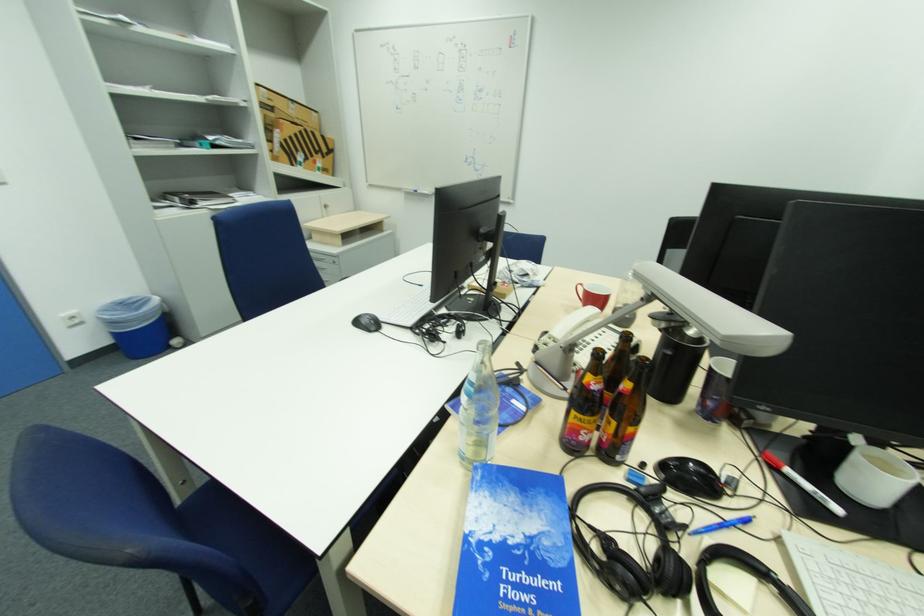
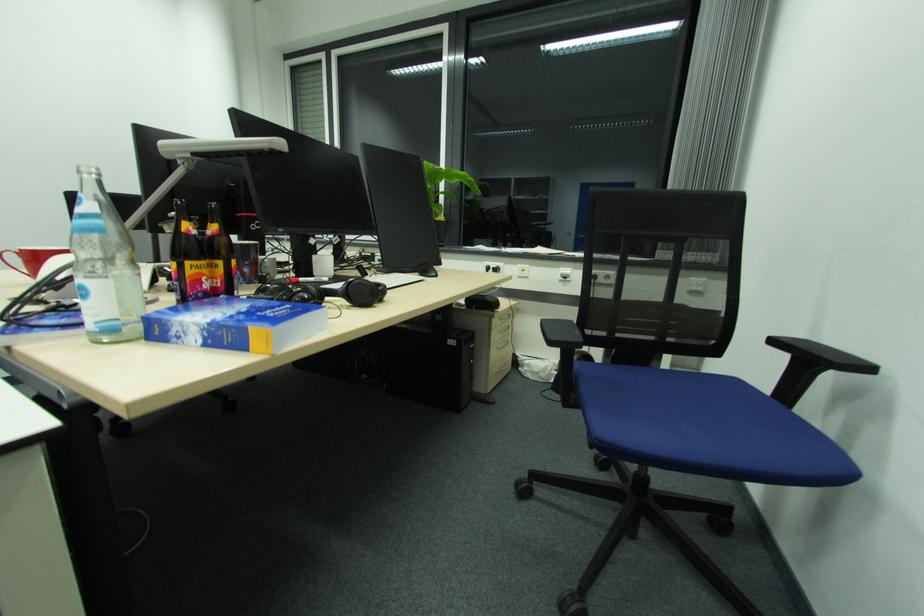
In the second image, find the point that corresponds to the point at 587,285 in the first image.

(15, 254)